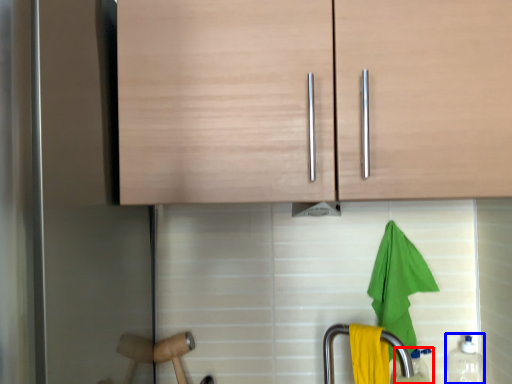
Question: Which point is closer to the camera, bottle (highlighted by a red box) or bottle (highlighted by a blue box)?

Choices:
 (A) bottle
 (B) bottle

Answer: (B)